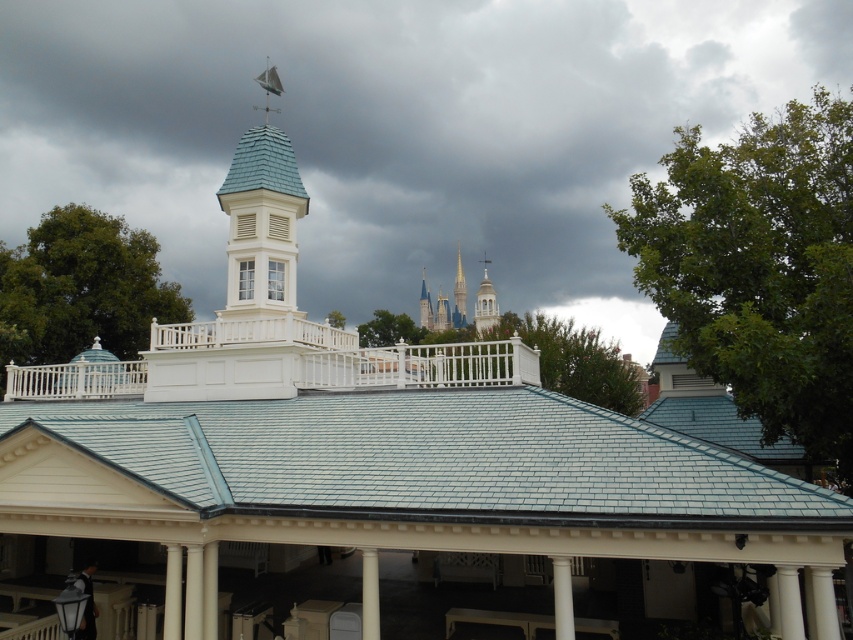
You are standing in front of the main building and see the point marked as point (369, 595). What object does this point correspond to?

The point (369, 595) corresponds to the white smooth pillar at center.

You are an architect analyzing the structure. You observe the teal slate roof at center and the white smooth pillar at center. Which object is positioned to the left when viewed from the front?

The teal slate roof at center is to the left of the white smooth pillar at center, so the teal slate roof at center is positioned to the left when viewed from the front.

You are standing at the entrance of the main building and want to find the white smooth pillar at center. Based on your position, which direction should you look to locate it?

The white smooth pillar at center is located at point coordinates, so you should look towards the center of the scene to find it.